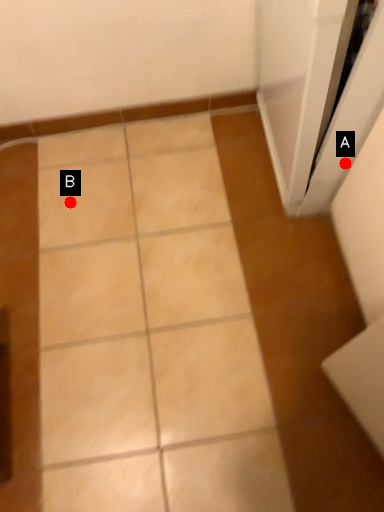
Question: Two points are circled on the image, labeled by A and B beside each circle. Which point is further to the camera?

Choices:
 (A) A is further
 (B) B is further

Answer: (B)